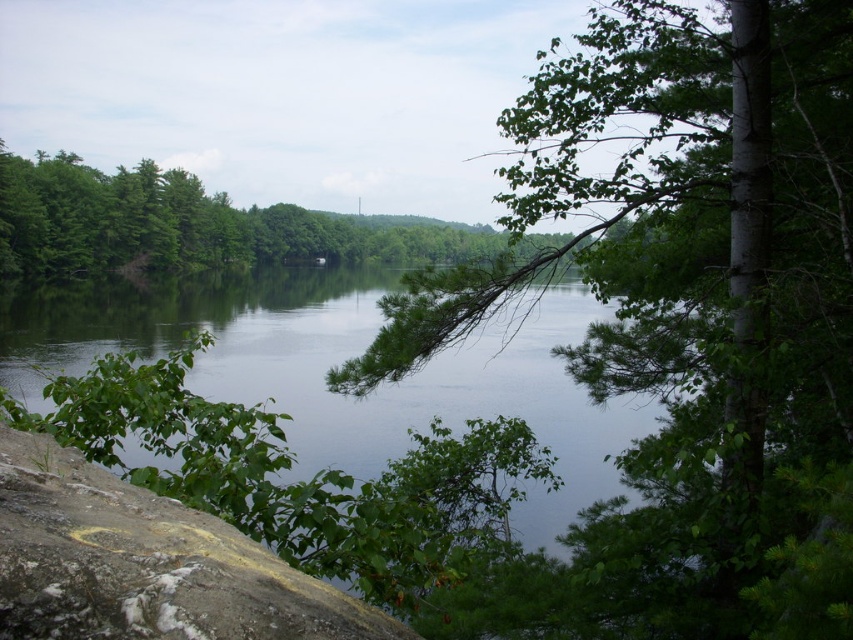
Is yellowish rock at lower left positioned at the back of green leafy tree at center?

That is False.

You are a GUI agent. You are given a task and a screenshot of the screen. Output one action in this format:
    pyautogui.click(x=<x>, y=<y>)
    Task: Click on the yellowish rock at lower left
    
    Given the screenshot: What is the action you would take?
    pyautogui.click(x=144, y=563)

Identify the location of yellowish rock at lower left. This screenshot has height=640, width=853. (144, 563).

From the picture: Can you confirm if green leafy river at center is positioned to the left of green leafy tree at center?

Incorrect, green leafy river at center is not on the left side of green leafy tree at center.

Does green leafy river at center appear on the right side of green leafy tree at center?

Correct, you'll find green leafy river at center to the right of green leafy tree at center.

Image resolution: width=853 pixels, height=640 pixels. Identify the location of green leafy river at center. (337, 362).

Can you confirm if green leafy branch at center right is positioned above yellowish rock at lower left?

Yes.

Does green leafy branch at center right have a lesser height compared to yellowish rock at lower left?

No, green leafy branch at center right is not shorter than yellowish rock at lower left.

Is point (792, 392) behind point (276, 577)?

Yes.

The image size is (853, 640). Identify the location of green leafy branch at center right. (680, 324).